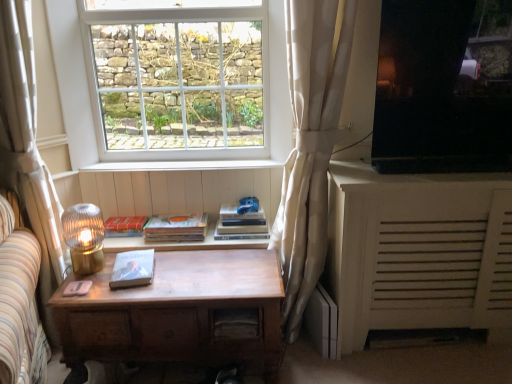
What are the coordinates of `free space above wooden desk at center (from a real-world perspective)` in the screenshot? It's located at (183, 268).